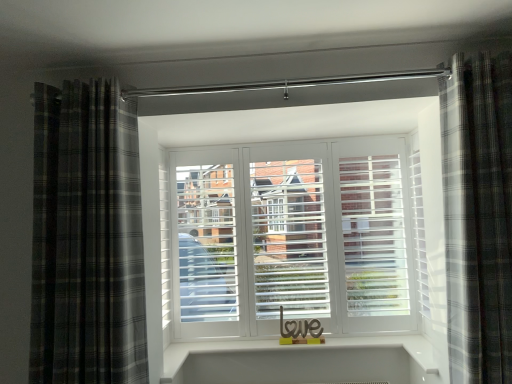
Find the location of a particular element. plaid fabric curtain at right, marked as the 2th curtain in a left-to-right arrangement is located at coordinates (478, 215).

What do you see at coordinates (478, 215) in the screenshot? This screenshot has height=384, width=512. I see `plaid fabric curtain at right, marked as the 2th curtain in a left-to-right arrangement` at bounding box center [478, 215].

What do you see at coordinates (87, 238) in the screenshot?
I see `plaid fabric curtain at left, placed as the first curtain when sorted from left to right` at bounding box center [87, 238].

The height and width of the screenshot is (384, 512). Identify the location of plaid fabric curtain at left, placed as the first curtain when sorted from left to right. (87, 238).

Identify the location of plaid fabric curtain at right, marked as the 2th curtain in a left-to-right arrangement. (478, 215).

Is plaid fabric curtain at right, marked as the 2th curtain in a left-to-right arrangement, at the left side of plaid fabric curtain at left, marked as the second curtain in a right-to-left arrangement?

In fact, plaid fabric curtain at right, marked as the 2th curtain in a left-to-right arrangement, is to the right of plaid fabric curtain at left, marked as the second curtain in a right-to-left arrangement.

Which object is further away from the camera, plaid fabric curtain at right, marked as the 2th curtain in a left-to-right arrangement, or plaid fabric curtain at left, placed as the first curtain when sorted from left to right?

plaid fabric curtain at left, placed as the first curtain when sorted from left to right, is behind.

Is point (445, 207) positioned behind point (112, 121)?

Yes, it is behind point (112, 121).

Consider the image. From the image's perspective, would you say plaid fabric curtain at right, marked as the 2th curtain in a left-to-right arrangement, is shown under plaid fabric curtain at left, marked as the second curtain in a right-to-left arrangement?

Actually, plaid fabric curtain at right, marked as the 2th curtain in a left-to-right arrangement, appears above plaid fabric curtain at left, marked as the second curtain in a right-to-left arrangement, in the image.

From a real-world perspective, relative to plaid fabric curtain at left, marked as the second curtain in a right-to-left arrangement, is plaid fabric curtain at right, which appears as the first curtain when viewed from the right, vertically above or below?

plaid fabric curtain at right, which appears as the first curtain when viewed from the right, is below plaid fabric curtain at left, marked as the second curtain in a right-to-left arrangement.

Is plaid fabric curtain at right, marked as the 2th curtain in a left-to-right arrangement, thinner than plaid fabric curtain at left, marked as the second curtain in a right-to-left arrangement?

Yes.

Considering the sizes of objects plaid fabric curtain at right, marked as the 2th curtain in a left-to-right arrangement, and plaid fabric curtain at left, placed as the first curtain when sorted from left to right, in the image provided, who is shorter, plaid fabric curtain at right, marked as the 2th curtain in a left-to-right arrangement, or plaid fabric curtain at left, placed as the first curtain when sorted from left to right,?

With less height is plaid fabric curtain at left, placed as the first curtain when sorted from left to right.

Considering the sizes of objects plaid fabric curtain at right, marked as the 2th curtain in a left-to-right arrangement, and plaid fabric curtain at left, placed as the first curtain when sorted from left to right, in the image provided, who is bigger, plaid fabric curtain at right, marked as the 2th curtain in a left-to-right arrangement, or plaid fabric curtain at left, placed as the first curtain when sorted from left to right,?

plaid fabric curtain at left, placed as the first curtain when sorted from left to right.

Is plaid fabric curtain at right, which appears as the first curtain when viewed from the right, positioned beyond the bounds of plaid fabric curtain at left, marked as the second curtain in a right-to-left arrangement?

Yes.

Looking at this image, are plaid fabric curtain at right, which appears as the first curtain when viewed from the right, and plaid fabric curtain at left, placed as the first curtain when sorted from left to right, far apart?

Yes.

Could you tell me if plaid fabric curtain at right, marked as the 2th curtain in a left-to-right arrangement, is facing plaid fabric curtain at left, placed as the first curtain when sorted from left to right?

No, plaid fabric curtain at right, marked as the 2th curtain in a left-to-right arrangement, is not turned towards plaid fabric curtain at left, placed as the first curtain when sorted from left to right.

How much distance is there between plaid fabric curtain at right, marked as the 2th curtain in a left-to-right arrangement, and plaid fabric curtain at left, placed as the first curtain when sorted from left to right?

4.92 feet.

At what (x,y) coordinates should I click in order to perform the action: click on curtain above the plaid fabric curtain at left, marked as the second curtain in a right-to-left arrangement (from the image's perspective). Please return your answer as a coordinate pair (x, y). The height and width of the screenshot is (384, 512). Looking at the image, I should click on coord(478,215).

Can you confirm if plaid fabric curtain at left, placed as the first curtain when sorted from left to right, is positioned to the right of plaid fabric curtain at right, marked as the 2th curtain in a left-to-right arrangement?

No.

From the picture: Is the depth of plaid fabric curtain at left, marked as the second curtain in a right-to-left arrangement, less than that of plaid fabric curtain at right, marked as the 2th curtain in a left-to-right arrangement?

No, plaid fabric curtain at left, marked as the second curtain in a right-to-left arrangement, is further to the viewer.

Is point (103, 366) in front of point (456, 316)?

Yes, point (103, 366) is in front of point (456, 316).

From the image's perspective, is plaid fabric curtain at left, marked as the second curtain in a right-to-left arrangement, above plaid fabric curtain at right, which appears as the first curtain when viewed from the right?

No, from the image's perspective, plaid fabric curtain at left, marked as the second curtain in a right-to-left arrangement, is not over plaid fabric curtain at right, which appears as the first curtain when viewed from the right.

From a real-world perspective, is plaid fabric curtain at left, placed as the first curtain when sorted from left to right, physically located above or below plaid fabric curtain at right, marked as the 2th curtain in a left-to-right arrangement?

In terms of real-world spatial position, plaid fabric curtain at left, placed as the first curtain when sorted from left to right, is above plaid fabric curtain at right, marked as the 2th curtain in a left-to-right arrangement.

Considering the sizes of objects plaid fabric curtain at left, marked as the second curtain in a right-to-left arrangement, and plaid fabric curtain at right, which appears as the first curtain when viewed from the right, in the image provided, who is wider, plaid fabric curtain at left, marked as the second curtain in a right-to-left arrangement, or plaid fabric curtain at right, which appears as the first curtain when viewed from the right,?

Wider between the two is plaid fabric curtain at left, marked as the second curtain in a right-to-left arrangement.

Between plaid fabric curtain at left, placed as the first curtain when sorted from left to right, and plaid fabric curtain at right, marked as the 2th curtain in a left-to-right arrangement, which one has more height?

plaid fabric curtain at right, marked as the 2th curtain in a left-to-right arrangement, is taller.

Which of these two, plaid fabric curtain at left, placed as the first curtain when sorted from left to right, or plaid fabric curtain at right, which appears as the first curtain when viewed from the right, is bigger?

plaid fabric curtain at left, placed as the first curtain when sorted from left to right.

Is plaid fabric curtain at left, marked as the second curtain in a right-to-left arrangement, positioned beyond the bounds of plaid fabric curtain at right, which appears as the first curtain when viewed from the right?

plaid fabric curtain at left, marked as the second curtain in a right-to-left arrangement, is positioned outside plaid fabric curtain at right, which appears as the first curtain when viewed from the right.

Are plaid fabric curtain at left, placed as the first curtain when sorted from left to right, and plaid fabric curtain at right, marked as the 2th curtain in a left-to-right arrangement, located far from each other?

Yes, plaid fabric curtain at left, placed as the first curtain when sorted from left to right, and plaid fabric curtain at right, marked as the 2th curtain in a left-to-right arrangement, are quite far apart.

Is plaid fabric curtain at left, marked as the second curtain in a right-to-left arrangement, aimed at plaid fabric curtain at right, which appears as the first curtain when viewed from the right?

No, plaid fabric curtain at left, marked as the second curtain in a right-to-left arrangement, is not turned towards plaid fabric curtain at right, which appears as the first curtain when viewed from the right.

Identify the location of curtain lying in front of the plaid fabric curtain at left, placed as the first curtain when sorted from left to right. Image resolution: width=512 pixels, height=384 pixels. (478, 215).

I want to click on curtain that is behind the plaid fabric curtain at right, which appears as the first curtain when viewed from the right, so click(x=87, y=238).

At what (x,y) coordinates should I click in order to perform the action: click on curtain in front of the plaid fabric curtain at left, marked as the second curtain in a right-to-left arrangement. Please return your answer as a coordinate pair (x, y). This screenshot has width=512, height=384. Looking at the image, I should click on (478, 215).